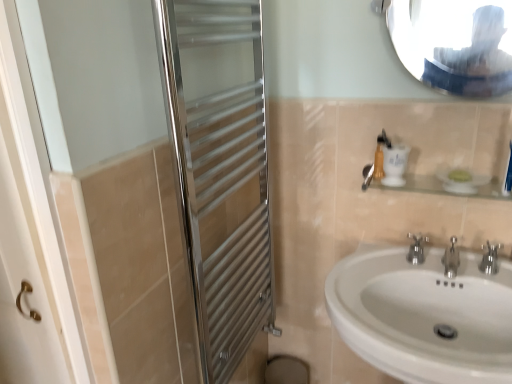
Describe the element at coordinates (455, 43) in the screenshot. I see `glossy metallic mirror at upper center` at that location.

Describe the element at coordinates (424, 315) in the screenshot. I see `white ceramic sink at lower right` at that location.

What do you see at coordinates (440, 187) in the screenshot? The image size is (512, 384). I see `clear glass shelf at upper right` at bounding box center [440, 187].

The width and height of the screenshot is (512, 384). What do you see at coordinates (416, 248) in the screenshot?
I see `chrome metallic faucet at sink center, which appears as the 3th tap when viewed from the right` at bounding box center [416, 248].

This screenshot has width=512, height=384. What do you see at coordinates (220, 168) in the screenshot? I see `polished chrome towel rack at left` at bounding box center [220, 168].

Where is `glossy metallic mirror at upper center`? This screenshot has width=512, height=384. glossy metallic mirror at upper center is located at coordinates (455, 43).

Would you say polished chrome towel rack at left is part of white ceramic sink at lower right's contents?

That's incorrect, polished chrome towel rack at left is not inside white ceramic sink at lower right.

Is white ceramic sink at lower right aimed at polished chrome towel rack at left?

No.

Based on the photo, is white ceramic sink at lower right wider or thinner than polished chrome towel rack at left?

Considering their sizes, white ceramic sink at lower right looks broader than polished chrome towel rack at left.

How different are the orientations of white ceramic sink at lower right and polished chrome towel rack at left in degrees?

91.6 degrees.

Is polished chrome towel rack at left completely or partially outside of polished metallic faucet at lower right, which is counted as the 1th tap, starting from the right?

Absolutely, polished chrome towel rack at left is external to polished metallic faucet at lower right, which is counted as the 1th tap, starting from the right.

From the image's perspective, count 2nd taps downward from the polished chrome towel rack at left and point to it. Please provide its 2D coordinates.

[(490, 259)]

From the image's perspective, is polished chrome towel rack at left positioned above or below polished metallic faucet at lower right, which is counted as the 1th tap, starting from the right?

Based on their image positions, polished chrome towel rack at left is located above polished metallic faucet at lower right, which is counted as the 1th tap, starting from the right.

Is point (162, 78) positioned in front of point (480, 263)?

Yes, it is in front of point (480, 263).

Which point is more forward, (x=479, y=319) or (x=487, y=263)?

The point (x=479, y=319) is more forward.

Could you tell me if white ceramic sink at lower right is facing polished metallic faucet at lower right, which is counted as the 1th tap, starting from the right?

No, white ceramic sink at lower right is not facing towards polished metallic faucet at lower right, which is counted as the 1th tap, starting from the right.

Is white ceramic sink at lower right taller or shorter than polished metallic faucet at lower right, which is counted as the 1th tap, starting from the right?

Clearly, white ceramic sink at lower right is taller compared to polished metallic faucet at lower right, which is counted as the 1th tap, starting from the right.

Based on the photo, which of these two, white ceramic sink at lower right or polished metallic faucet at lower right, which is counted as the 1th tap, starting from the right, is smaller?

Smaller between the two is polished metallic faucet at lower right, which is counted as the 1th tap, starting from the right.

Is glossy metallic mirror at upper center positioned behind clear glass shelf at upper right?

No, the depth of glossy metallic mirror at upper center is less than that of clear glass shelf at upper right.

Is clear glass shelf at upper right inside glossy metallic mirror at upper center?

No, glossy metallic mirror at upper center does not contain clear glass shelf at upper right.

From a real-world perspective, is glossy metallic mirror at upper center on top of clear glass shelf at upper right?

Yes.

How different are the orientations of polished chrome towel rack at left and glossy metallic mirror at upper center in degrees?

The angle between the facing direction of polished chrome towel rack at left and the facing direction of glossy metallic mirror at upper center is 89.4 degrees.

Would you consider polished chrome towel rack at left to be distant from glossy metallic mirror at upper center?

That's not correct — polished chrome towel rack at left is a little close to glossy metallic mirror at upper center.

From the image's perspective, is polished chrome towel rack at left above or below glossy metallic mirror at upper center?

polished chrome towel rack at left is below glossy metallic mirror at upper center.

Does polished chrome towel rack at left have a smaller size compared to glossy metallic mirror at upper center?

Actually, polished chrome towel rack at left might be larger than glossy metallic mirror at upper center.

Is white ceramic sink at lower right not close to silver metallic tap at center, arranged as the second tap when viewed from the right?

Actually, white ceramic sink at lower right and silver metallic tap at center, arranged as the second tap when viewed from the right, are a little close together.

From the image's perspective, is white ceramic sink at lower right below silver metallic tap at center, arranged as the 2th tap when viewed from the left?

Yes, from the image's perspective, white ceramic sink at lower right is below silver metallic tap at center, arranged as the 2th tap when viewed from the left.

Is white ceramic sink at lower right behind silver metallic tap at center, arranged as the second tap when viewed from the right?

No, it is not.

Relative to glossy metallic mirror at upper center, is white ceramic sink at lower right in front or behind?

Clearly, white ceramic sink at lower right is in front of glossy metallic mirror at upper center.

Is white ceramic sink at lower right taller than glossy metallic mirror at upper center?

Indeed, white ceramic sink at lower right has a greater height compared to glossy metallic mirror at upper center.

From a real-world perspective, is white ceramic sink at lower right positioned above or below glossy metallic mirror at upper center?

From a real-world perspective, white ceramic sink at lower right is physically below glossy metallic mirror at upper center.

Considering the sizes of objects white ceramic sink at lower right and glossy metallic mirror at upper center in the image provided, who is bigger, white ceramic sink at lower right or glossy metallic mirror at upper center?

white ceramic sink at lower right.

Where is `sink lying behind the polished chrome towel rack at left`? sink lying behind the polished chrome towel rack at left is located at coordinates (424, 315).

You are a GUI agent. You are given a task and a screenshot of the screen. Output one action in this format:
    pyautogui.click(x=<x>, y=<y>)
    Task: Click on the screen door above the polished metallic faucet at lower right, which is counted as the third tap, starting from the left (from the image's perspective)
    Image resolution: width=512 pixels, height=384 pixels.
    Given the screenshot: What is the action you would take?
    pyautogui.click(x=220, y=168)

Based on their spatial positions, is glossy metallic mirror at upper center or chrome metallic faucet at sink center, marked as the first tap in a left-to-right arrangement, closer to polished metallic faucet at lower right, which is counted as the third tap, starting from the left?

chrome metallic faucet at sink center, marked as the first tap in a left-to-right arrangement, lies closer to polished metallic faucet at lower right, which is counted as the third tap, starting from the left, than the other object.

From the image, which object appears to be nearer to silver metallic tap at center, arranged as the 2th tap when viewed from the left, polished metallic faucet at lower right, which is counted as the 1th tap, starting from the right, or white ceramic sink at lower right?

polished metallic faucet at lower right, which is counted as the 1th tap, starting from the right, is positioned closer to the anchor silver metallic tap at center, arranged as the 2th tap when viewed from the left.

Looking at the image, which one is located closer to polished chrome towel rack at left, polished metallic faucet at lower right, which is counted as the 1th tap, starting from the right, or silver metallic tap at center, arranged as the 2th tap when viewed from the left?

silver metallic tap at center, arranged as the 2th tap when viewed from the left.

Looking at the image, which one is located further to silver metallic tap at center, arranged as the second tap when viewed from the right, glossy metallic mirror at upper center or white ceramic sink at lower right?

The object further to silver metallic tap at center, arranged as the second tap when viewed from the right, is glossy metallic mirror at upper center.

When comparing their distances from glossy metallic mirror at upper center, does clear glass shelf at upper right or polished metallic faucet at lower right, which is counted as the third tap, starting from the left, seem further?

polished metallic faucet at lower right, which is counted as the third tap, starting from the left, is positioned further to the anchor glossy metallic mirror at upper center.

Looking at this image, considering their positions, is polished metallic faucet at lower right, which is counted as the 1th tap, starting from the right, positioned further to silver metallic tap at center, arranged as the 2th tap when viewed from the left, than polished chrome towel rack at left?

polished chrome towel rack at left.

Considering their positions, is polished chrome towel rack at left positioned further to chrome metallic faucet at sink center, marked as the first tap in a left-to-right arrangement, than clear glass shelf at upper right?

Based on the image, polished chrome towel rack at left appears to be further to chrome metallic faucet at sink center, marked as the first tap in a left-to-right arrangement.

From the image, which object appears to be nearer to chrome metallic faucet at sink center, marked as the first tap in a left-to-right arrangement, white ceramic sink at lower right or glossy metallic mirror at upper center?

white ceramic sink at lower right is closer to chrome metallic faucet at sink center, marked as the first tap in a left-to-right arrangement.

I want to click on tap between clear glass shelf at upper right and polished metallic faucet at lower right, which is counted as the 1th tap, starting from the right, vertically, so pyautogui.click(x=416, y=248).

Where is `tap between chrome metallic faucet at sink center, marked as the first tap in a left-to-right arrangement, and polished metallic faucet at lower right, which is counted as the third tap, starting from the left, from left to right`? tap between chrome metallic faucet at sink center, marked as the first tap in a left-to-right arrangement, and polished metallic faucet at lower right, which is counted as the third tap, starting from the left, from left to right is located at coordinates (451, 259).

Identify the location of mirror between polished chrome towel rack at left and polished metallic faucet at lower right, which is counted as the 1th tap, starting from the right, in the horizontal direction. The width and height of the screenshot is (512, 384). (455, 43).

This screenshot has width=512, height=384. I want to click on tap located between polished chrome towel rack at left and clear glass shelf at upper right in the left-right direction, so click(416, 248).